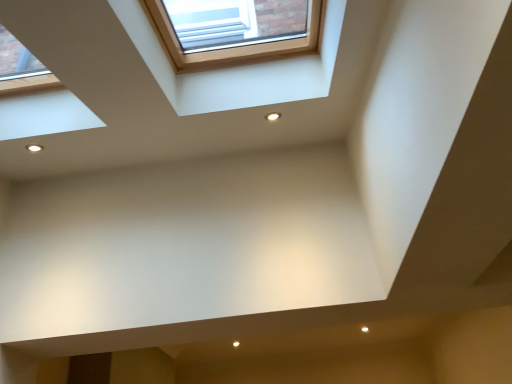
Find the location of `white glass window at upper left`. white glass window at upper left is located at coordinates (35, 96).

What do you see at coordinates (35, 96) in the screenshot? The image size is (512, 384). I see `white glass window at upper left` at bounding box center [35, 96].

Identify the location of white glass window at upper left. (35, 96).